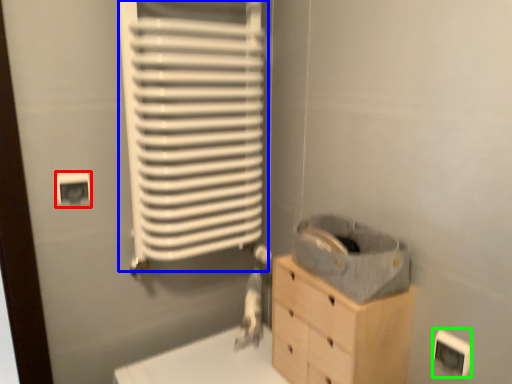
Question: Considering the real-world distances, which object is farthest from electric outlet (highlighted by a red box)? radiator (highlighted by a blue box) or electric outlet (highlighted by a green box)?

Choices:
 (A) radiator
 (B) electric outlet

Answer: (B)